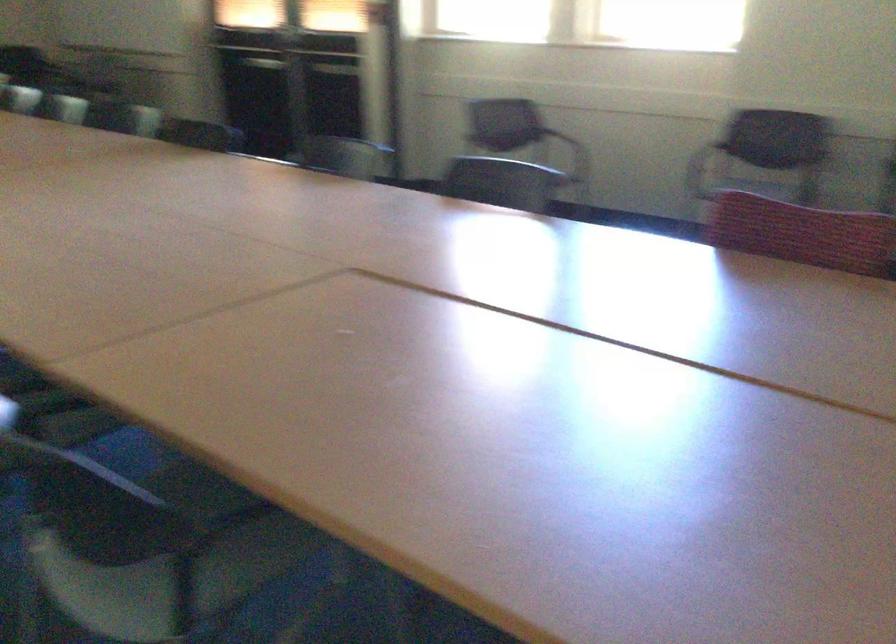
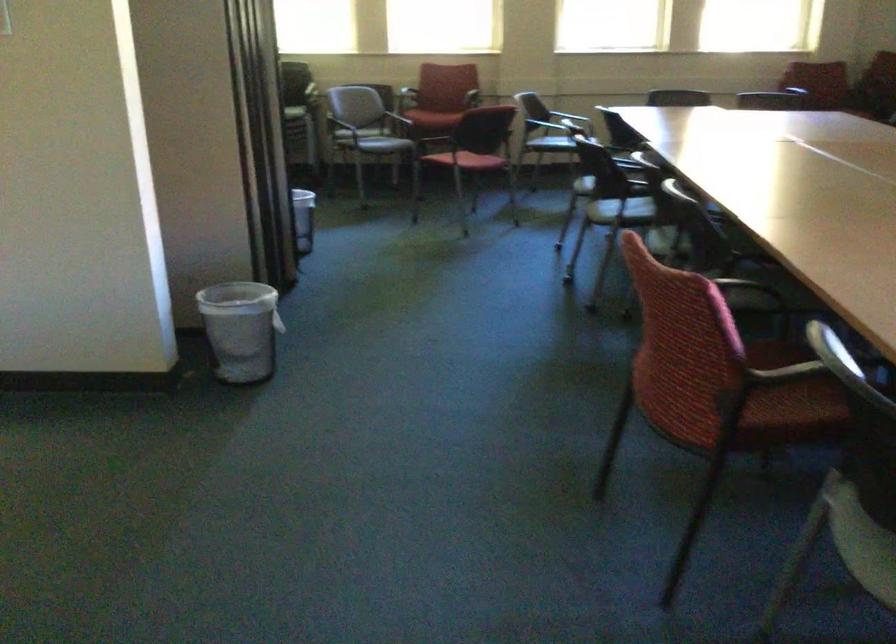
Question: The camera is either moving clockwise (left) or counter-clockwise (right) around the object. The first image is from the beginning of the video and the second image is from the end. Is the camera moving left or right when shooting the video?

Choices:
 (A) Left
 (B) Right

Answer: (B)